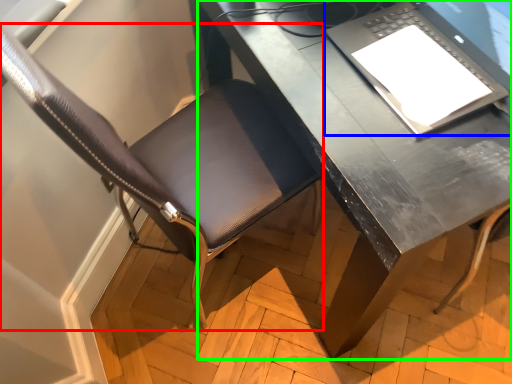
Question: Estimate the real-world distances between objects in this image. Which object is farther from chair (highlighted by a red box), laptop (highlighted by a blue box) or desk (highlighted by a green box)?

Choices:
 (A) laptop
 (B) desk

Answer: (A)